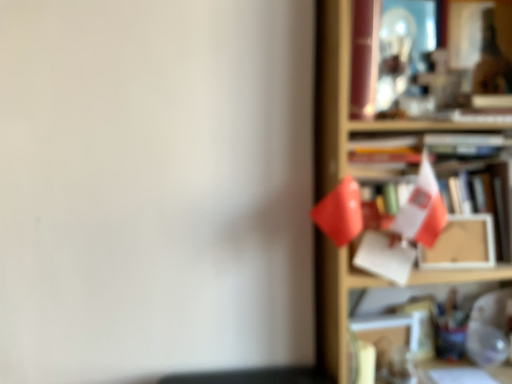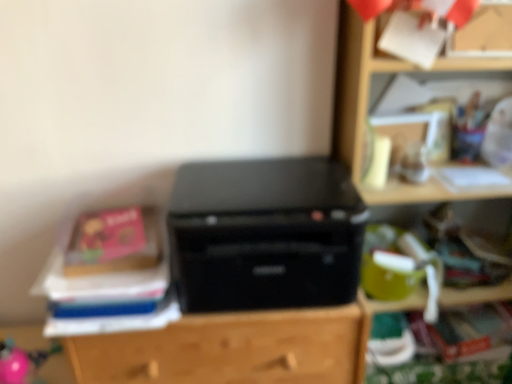
Question: Which way did the camera rotate in the video?

Choices:
 (A) rotated downward
 (B) rotated upward

Answer: (A)